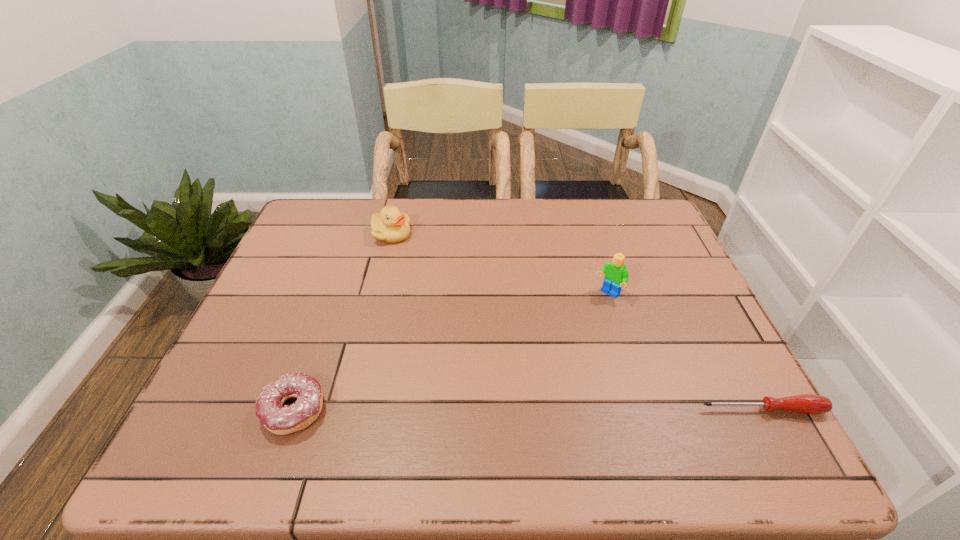
Locate an element on the screen. This screenshot has width=960, height=540. free space on the desktop that is between the doughnut and the shortest object and is positioned on the face of the second object from right to left is located at coordinates coord(508,410).

This screenshot has width=960, height=540. What are the coordinates of `vacant space on the desktop that is between the doughnut and the rightmost object and is positioned on the front-facing side of the farthest object` in the screenshot? It's located at (478, 410).